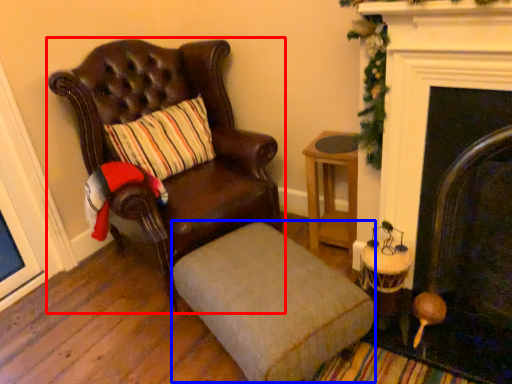
Question: Which point is closer to the camera, chair (highlighted by a red box) or footrest (highlighted by a blue box)?

Choices:
 (A) chair
 (B) footrest

Answer: (B)